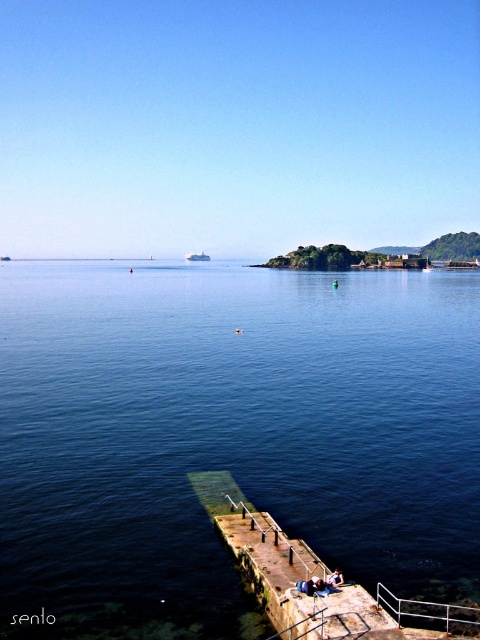
You are a photographer standing on the jetty and want to take a photo of both the white metal rail at lower right and the denim jacket at lower center. Which object should you focus on first if you want both to be in sharp focus?

You should focus on the white metal rail at lower right first because it is closer to the viewer than the denim jacket at lower center. By focusing on the closer object, the farther one may still be in focus depending on the depth of field.

You are standing on the jetty and see the blue water at center and the denim jacket at lower center. Which object appears taller from your viewpoint?

The blue water at center appears taller than the denim jacket at lower center because it has a greater height compared to the denim jacket at lower center.